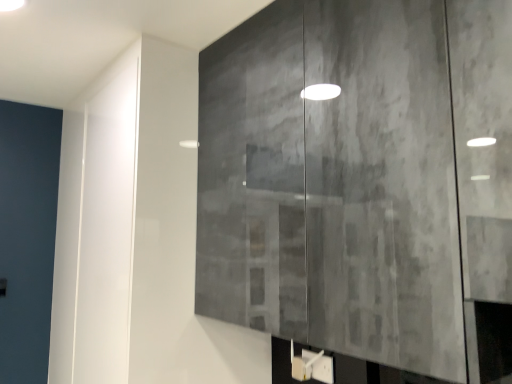
The height and width of the screenshot is (384, 512). In order to click on white plastic light switch at lower right in this screenshot , I will do `click(318, 366)`.

Image resolution: width=512 pixels, height=384 pixels. Describe the element at coordinates (318, 366) in the screenshot. I see `white plastic light switch at lower right` at that location.

At what (x,y) coordinates should I click in order to perform the action: click on white plastic light switch at lower right. Please return your answer as a coordinate pair (x, y). This screenshot has height=384, width=512. Looking at the image, I should click on (318, 366).